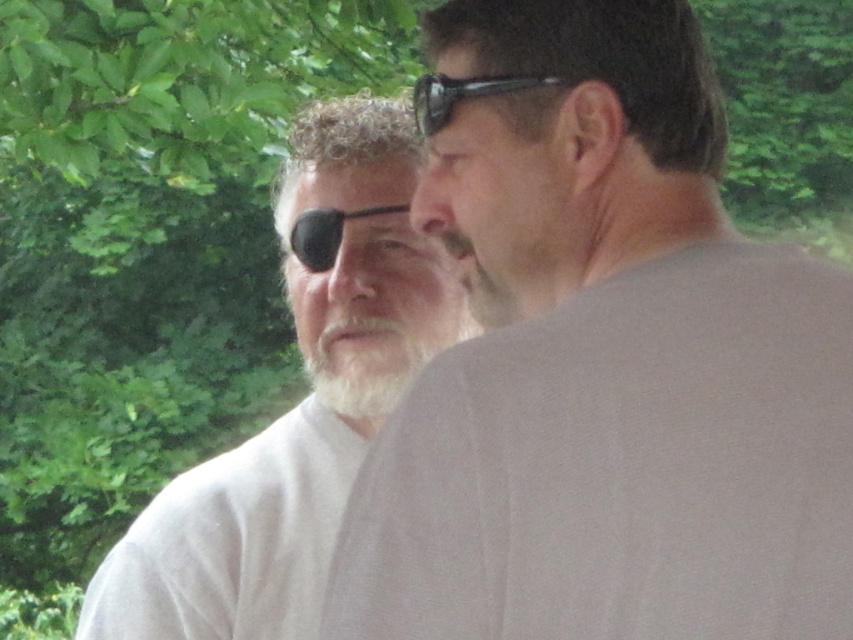
Question: Does white soft beard at center appear on the left side of black rubber goggles at upper center?

Choices:
 (A) no
 (B) yes

Answer: (A)

Question: Which object is positioned closest to the white matte shirt at left?

Choices:
 (A) white matte shirt at center
 (B) white soft beard at center
 (C) black plastic sunglasses at upper center

Answer: (B)

Question: Is white matte shirt at left below black rubber goggles at upper center?

Choices:
 (A) no
 (B) yes

Answer: (B)

Question: Estimate the real-world distances between objects in this image. Which object is closer to the black rubber goggles at upper center?

Choices:
 (A) white soft beard at center
 (B) black plastic sunglasses at upper center

Answer: (A)

Question: Among these points, which one is farthest from the camera?

Choices:
 (A) (340, 234)
 (B) (334, 332)
 (C) (354, 336)

Answer: (A)

Question: Can you confirm if white matte shirt at center is wider than white soft beard at center?

Choices:
 (A) no
 (B) yes

Answer: (B)